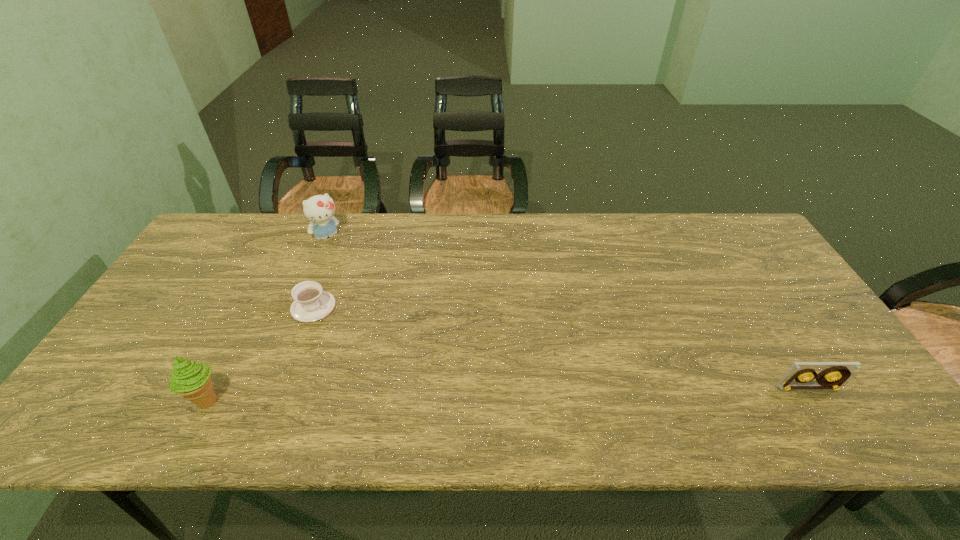
The height and width of the screenshot is (540, 960). I want to click on vacant space located 0.310m on the front-facing side of the farthest object, so click(374, 302).

Where is `free space located 0.320m on the front-facing side of the farthest object`? The width and height of the screenshot is (960, 540). free space located 0.320m on the front-facing side of the farthest object is located at coordinates pyautogui.click(x=376, y=305).

Find the location of a particular element. vacant point located 0.110m on the front-facing side of the farthest object is located at coordinates (348, 264).

The image size is (960, 540). What are the coordinates of `object located in the far edge section of the desktop` in the screenshot? It's located at (319, 209).

You are a GUI agent. You are given a task and a screenshot of the screen. Output one action in this format:
    pyautogui.click(x=<x>, y=<y>)
    Task: Click on the icecream at the near edge
    
    Given the screenshot: What is the action you would take?
    pyautogui.click(x=192, y=380)

At what (x,y) coordinates should I click in order to perform the action: click on videotape that is at the near edge. Please return your answer as a coordinate pair (x, y). The width and height of the screenshot is (960, 540). Looking at the image, I should click on (833, 374).

Image resolution: width=960 pixels, height=540 pixels. I want to click on object present at the right edge, so click(x=833, y=374).

Locate an element on the screen. object located at the near right corner is located at coordinates (833, 374).

The width and height of the screenshot is (960, 540). I want to click on vacant space at the far edge of the desktop, so click(546, 234).

Locate an element on the screen. Image resolution: width=960 pixels, height=540 pixels. vacant space at the near edge is located at coordinates (537, 392).